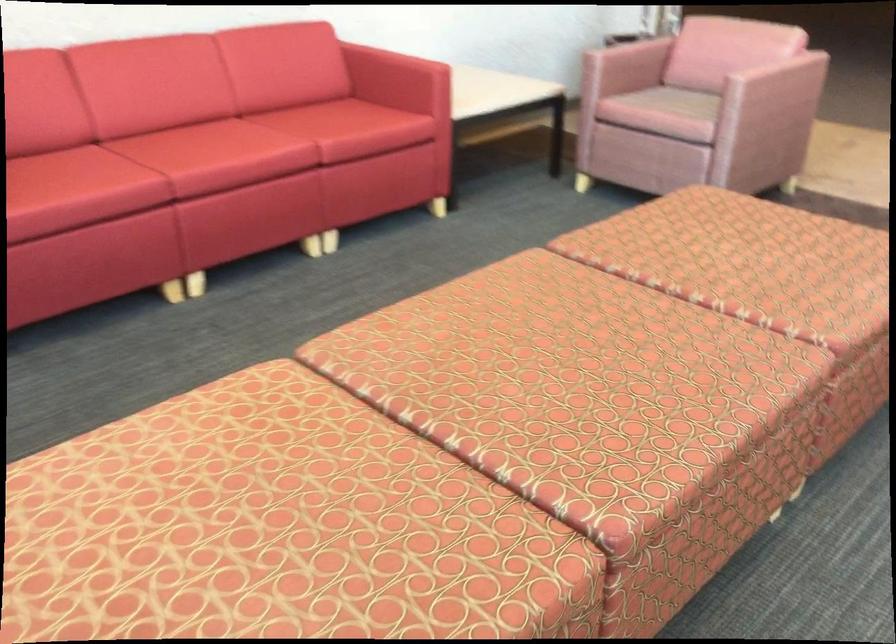
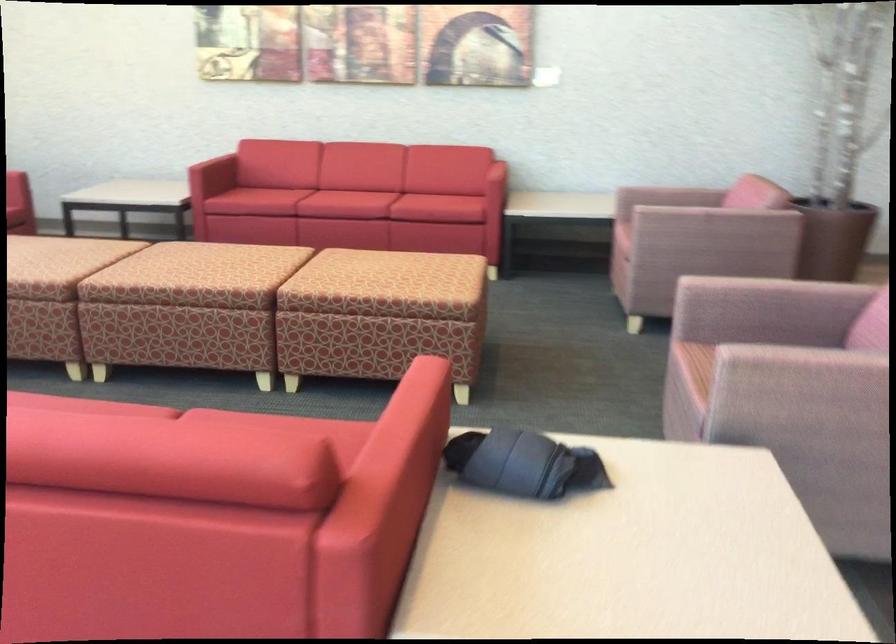
Locate, in the second image, the point that corresponds to (642,107) in the first image.

(624, 218)